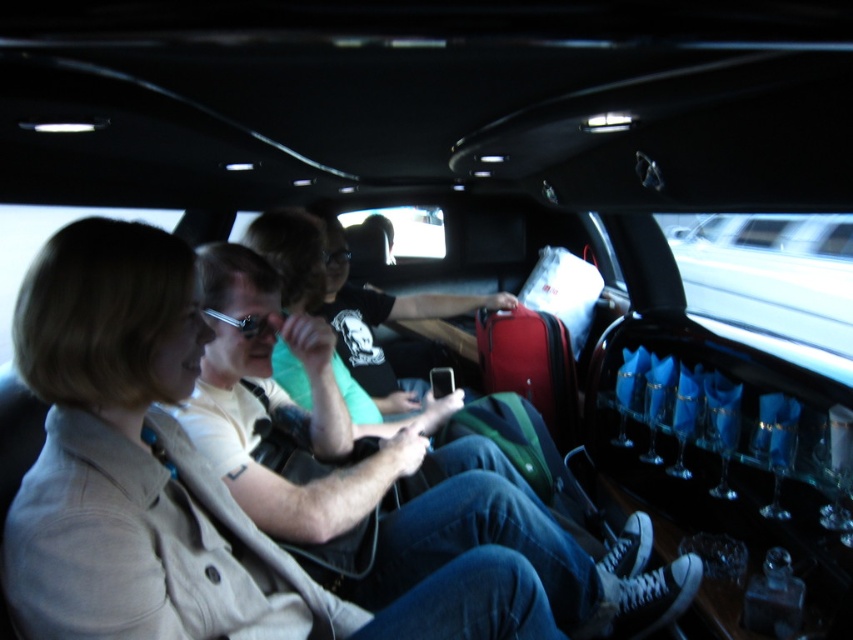
Question: Which point is closer to the camera?

Choices:
 (A) (485, 300)
 (B) (149, 604)

Answer: (B)

Question: Does light beige jacket at center appear on the right side of matte black phone at center?

Choices:
 (A) no
 (B) yes

Answer: (A)

Question: Is light beige jacket at center behind matte black phone at center?

Choices:
 (A) no
 (B) yes

Answer: (A)

Question: Which of the following is the farthest from the observer?

Choices:
 (A) light beige jacket at center
 (B) matte black phone at center

Answer: (B)

Question: Which point appears closest to the camera in this image?

Choices:
 (A) (370, 328)
 (B) (103, 342)

Answer: (B)

Question: Does light beige jacket at center appear on the right side of matte black phone at center?

Choices:
 (A) yes
 (B) no

Answer: (B)